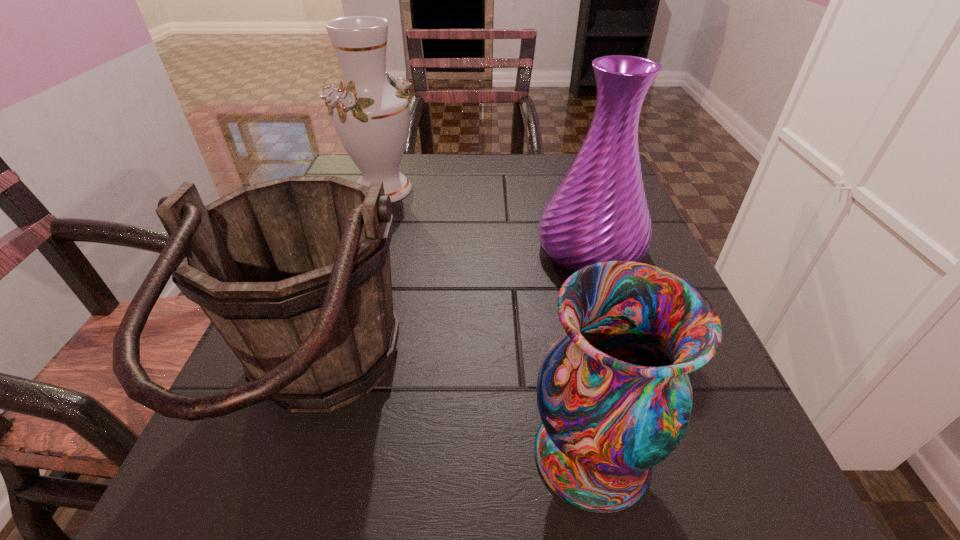
Find the location of a particular element. The image size is (960, 540). free space at the far right corner is located at coordinates (558, 178).

The image size is (960, 540). What are the coordinates of `free spot at the near right corner of the desktop` in the screenshot? It's located at [660, 495].

The image size is (960, 540). I want to click on empty space between the bucket and the second farthest vase, so click(x=454, y=320).

I want to click on free space that is in between the shortest vase and the farthest vase, so click(487, 322).

You are a GUI agent. You are given a task and a screenshot of the screen. Output one action in this format:
    pyautogui.click(x=<x>, y=<y>)
    Task: Click on the vacant space in between the second farthest object and the bucket
    The image size is (960, 540).
    Given the screenshot: What is the action you would take?
    pyautogui.click(x=454, y=320)

Identify the location of vacant point located between the second nearest vase and the farthest object. (487, 220).

Identify the location of vacant region between the second farthest object and the leftmost vase. (487, 220).

The width and height of the screenshot is (960, 540). I want to click on free spot between the shortest vase and the farthest object, so click(x=487, y=322).

Where is `vacant region between the second farthest vase and the bucket`? Image resolution: width=960 pixels, height=540 pixels. vacant region between the second farthest vase and the bucket is located at coordinates (454, 320).

You are a GUI agent. You are given a task and a screenshot of the screen. Output one action in this format:
    pyautogui.click(x=<x>, y=<y>)
    Task: Click on the free spot between the shortest vase and the bucket
    This screenshot has height=540, width=960.
    Given the screenshot: What is the action you would take?
    pyautogui.click(x=454, y=422)